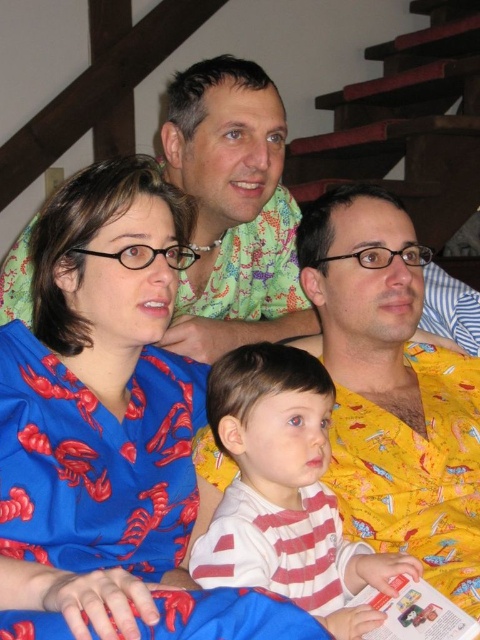
You are standing in the room and want to hand a book to both the blue satin blouse at center and the green floral shirt at upper center. Which one should you give the book to first based on their positions?

You should give the book to the blue satin blouse at center first because it is closer to you than the green floral shirt at upper center.

You are standing in a living room with a staircase behind you. You see the green floral shirt at upper center and the white striped shirt at center. Which shirt is closer to you?

The green floral shirt at upper center is closer to you because it is further to the viewer than the white striped shirt at center.